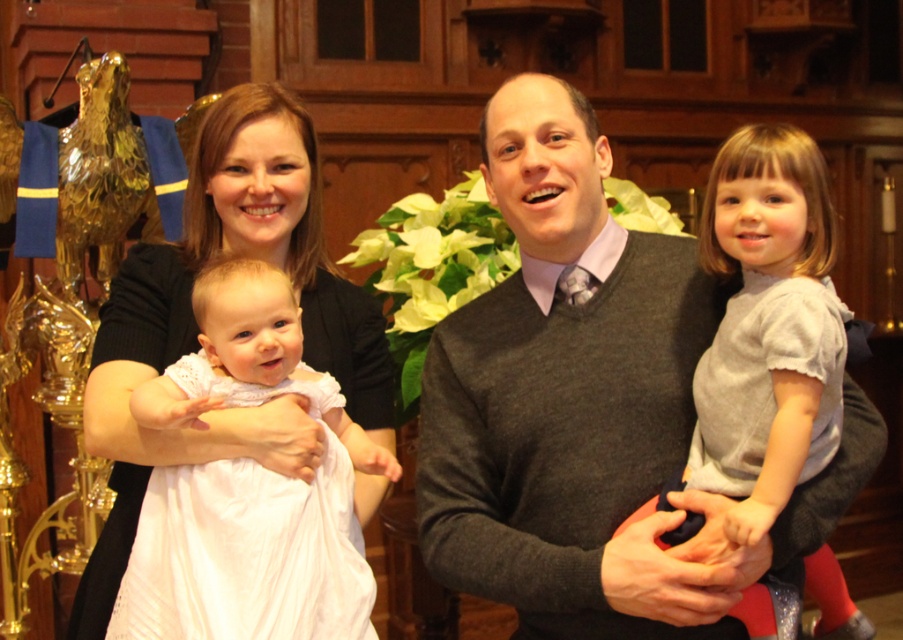
Question: Can you confirm if gray sweater at center is positioned below gray cotton dress at right?

Choices:
 (A) no
 (B) yes

Answer: (B)

Question: Is black matte dress at center to the right of gray cotton dress at right from the viewer's perspective?

Choices:
 (A) yes
 (B) no

Answer: (B)

Question: Which object is positioned closest to the gray sweater at center?

Choices:
 (A) black matte dress at center
 (B) gray cotton dress at right

Answer: (B)

Question: Among these objects, which one is nearest to the camera?

Choices:
 (A) gray sweater at center
 (B) gray cotton dress at right

Answer: (B)

Question: Which object is closer to the camera taking this photo?

Choices:
 (A) black matte dress at center
 (B) gray sweater at center
 (C) gray cotton dress at right

Answer: (C)

Question: Considering the relative positions of black matte dress at center and gray cotton dress at right in the image provided, where is black matte dress at center located with respect to gray cotton dress at right?

Choices:
 (A) left
 (B) right

Answer: (A)